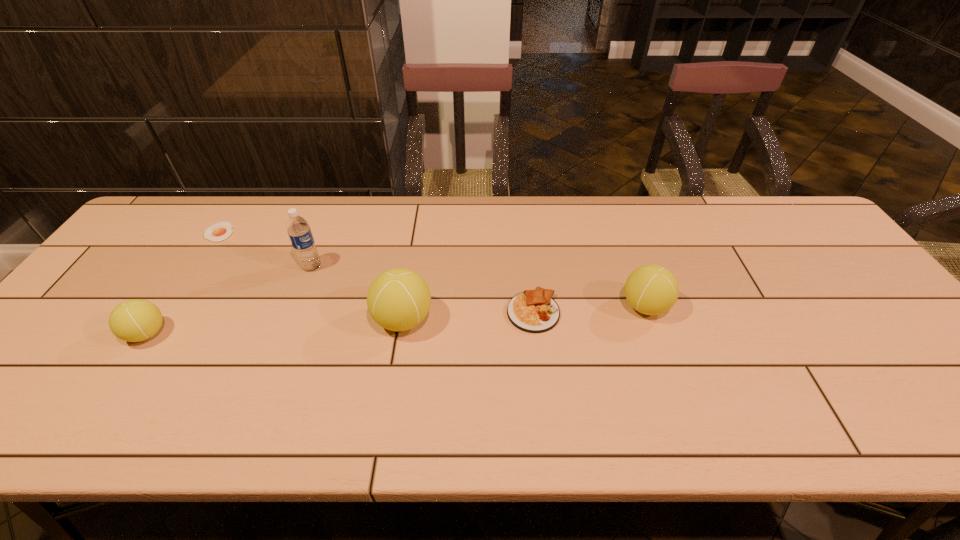
Identify the location of vacant space at the near edge of the desktop. The width and height of the screenshot is (960, 540). (127, 396).

Find the location of a particular element. Image resolution: width=960 pixels, height=540 pixels. vacant space at the right edge of the desktop is located at coordinates (864, 343).

The image size is (960, 540). I want to click on free space at the far left corner of the desktop, so click(200, 215).

I want to click on vacant area at the far right corner, so click(x=764, y=213).

Find the location of a particular element. Image resolution: width=960 pixels, height=540 pixels. unoccupied area between the fourth tallest object and the fifth nearest object is located at coordinates (229, 300).

Where is `vacant space in between the fifth nearest object and the third shortest object`? The width and height of the screenshot is (960, 540). vacant space in between the fifth nearest object and the third shortest object is located at coordinates (229, 300).

The width and height of the screenshot is (960, 540). In order to click on free space between the second object from right to left and the second tennis ball from left to right in this screenshot , I will do `click(468, 315)`.

At what (x,y) coordinates should I click in order to perform the action: click on empty space between the third tallest object and the omelet. Please return your answer as a coordinate pair (x, y). Looking at the image, I should click on 589,309.

This screenshot has height=540, width=960. In order to click on vacant space in between the fifth nearest object and the egg yolk in this screenshot , I will do `click(265, 249)`.

This screenshot has width=960, height=540. What are the coordinates of `vacant area that lies between the tallest tennis ball and the egg yolk` in the screenshot? It's located at [311, 276].